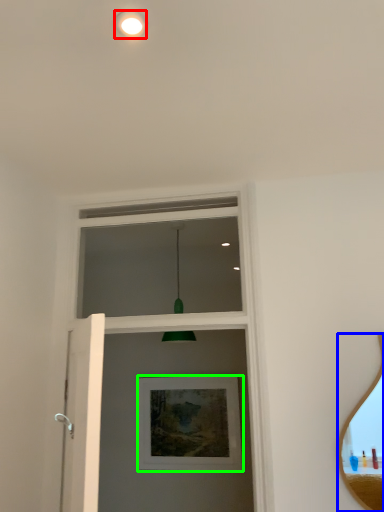
Question: Considering the real-world distances, which object is closest to droplight (highlighted by a red box)? mirror (highlighted by a blue box) or picture frame (highlighted by a green box).

Choices:
 (A) mirror
 (B) picture frame

Answer: (A)